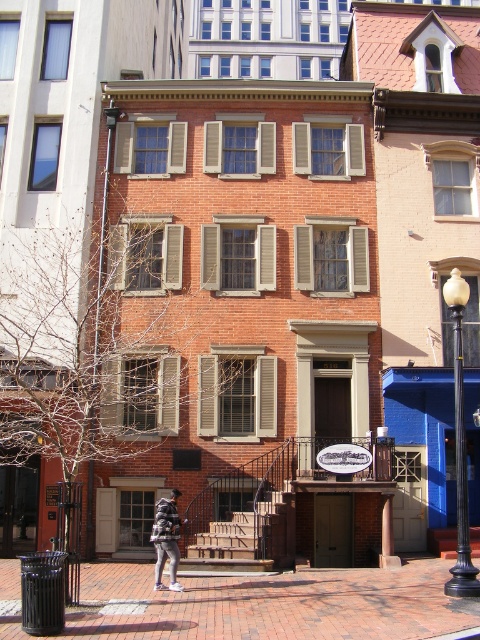
Question: Which object is closer to the camera taking this photo?

Choices:
 (A) striped sweater at center
 (B) white glossy lamp post at right
 (C) brick pavement at center

Answer: (C)

Question: Among these objects, which one is farthest from the camera?

Choices:
 (A) brick pavement at center
 (B) white glossy lamp post at right
 (C) striped sweater at center

Answer: (C)

Question: Which point is farther from the camera taking this photo?

Choices:
 (A) (456, 408)
 (B) (176, 500)

Answer: (B)

Question: Is white glossy lamp post at right to the left of striped sweater at center from the viewer's perspective?

Choices:
 (A) yes
 (B) no

Answer: (B)

Question: Does brick pavement at center lie in front of white glossy lamp post at right?

Choices:
 (A) no
 (B) yes

Answer: (B)

Question: Can you confirm if brick pavement at center is positioned below white glossy lamp post at right?

Choices:
 (A) no
 (B) yes

Answer: (B)